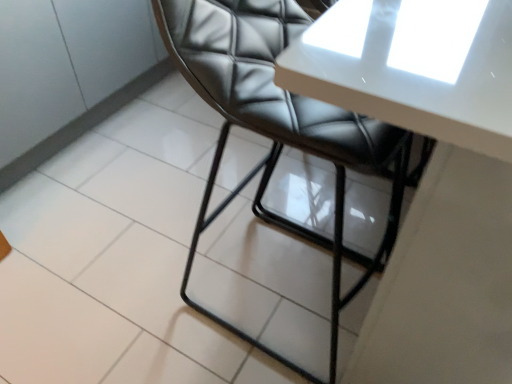
Measure the distance between black leather chair at center and camera.

They are 63.46 centimeters apart.

The image size is (512, 384). I want to click on black leather chair at center, so click(x=281, y=127).

The width and height of the screenshot is (512, 384). What do you see at coordinates (281, 127) in the screenshot?
I see `black leather chair at center` at bounding box center [281, 127].

The image size is (512, 384). Describe the element at coordinates (429, 182) in the screenshot. I see `white glossy table at upper center` at that location.

Looking at this image, what is the approximate height of white glossy table at upper center?

white glossy table at upper center is 91.91 centimeters in height.

Where is `white glossy table at upper center`? This screenshot has width=512, height=384. white glossy table at upper center is located at coordinates (429, 182).

Identify the location of black leather chair at center. (281, 127).

Considering the positions of objects white glossy table at upper center and black leather chair at center in the image provided, who is more to the left, white glossy table at upper center or black leather chair at center?

From the viewer's perspective, black leather chair at center appears more on the left side.

Considering their positions, is white glossy table at upper center located in front of or behind black leather chair at center?

In the image, white glossy table at upper center appears in front of black leather chair at center.

Is point (479, 297) closer to camera compared to point (190, 76)?

Yes, it is in front of point (190, 76).

From the image's perspective, relative to black leather chair at center, is white glossy table at upper center above or below?

Based on their image positions, white glossy table at upper center is located above black leather chair at center.

From a real-world perspective, is white glossy table at upper center below black leather chair at center?

Yes.

Is white glossy table at upper center thinner than black leather chair at center?

Incorrect, the width of white glossy table at upper center is not less than that of black leather chair at center.

Can you confirm if white glossy table at upper center is taller than black leather chair at center?

In fact, white glossy table at upper center may be shorter than black leather chair at center.

Can you confirm if white glossy table at upper center is bigger than black leather chair at center?

Yes.

Would you say black leather chair at center is part of white glossy table at upper center's contents?

Yes, black leather chair at center can be found within white glossy table at upper center.

Are white glossy table at upper center and black leather chair at center far apart?

No, white glossy table at upper center is in close proximity to black leather chair at center.

Could you tell me if white glossy table at upper center is facing black leather chair at center?

No, white glossy table at upper center is not facing towards black leather chair at center.

How many degrees apart are the facing directions of white glossy table at upper center and black leather chair at center?

white glossy table at upper center and black leather chair at center are facing 0.338 degrees away from each other.

Image resolution: width=512 pixels, height=384 pixels. I want to click on table above the black leather chair at center (from the image's perspective), so click(429, 182).

Considering the positions of objects black leather chair at center and white glossy table at upper center in the image provided, who is more to the left, black leather chair at center or white glossy table at upper center?

Positioned to the left is black leather chair at center.

Who is more distant, black leather chair at center or white glossy table at upper center?

black leather chair at center is behind.

Considering the points (391, 202) and (410, 225), which point is in front, point (391, 202) or point (410, 225)?

Positioned in front is point (410, 225).

From the image's perspective, is black leather chair at center above white glossy table at upper center?

Incorrect, from the image's perspective, black leather chair at center is lower than white glossy table at upper center.

In the scene shown: From a real-world perspective, is black leather chair at center positioned above or below white glossy table at upper center?

Clearly, from a real-world perspective, black leather chair at center is above white glossy table at upper center.

Is black leather chair at center wider than white glossy table at upper center?

No, black leather chair at center is not wider than white glossy table at upper center.

Which of these two, black leather chair at center or white glossy table at upper center, stands shorter?

Standing shorter between the two is white glossy table at upper center.

Between black leather chair at center and white glossy table at upper center, which one has larger size?

Bigger between the two is white glossy table at upper center.

Would you say black leather chair at center is outside white glossy table at upper center?

No, black leather chair at center is not entirely external to white glossy table at upper center.

Is black leather chair at center beside white glossy table at upper center?

black leather chair at center and white glossy table at upper center are not in contact.

From the picture: Is black leather chair at center positioned with its back to white glossy table at upper center?

black leather chair at center is not turned away from white glossy table at upper center.

Measure the distance from black leather chair at center to white glossy table at upper center.

black leather chair at center and white glossy table at upper center are 10.65 inches apart from each other.

Locate an element on the screen. chair behind the white glossy table at upper center is located at coordinates (281, 127).

Locate an element on the screen. The height and width of the screenshot is (384, 512). chair on the left of white glossy table at upper center is located at coordinates (281, 127).

Identify the location of table in front of the black leather chair at center. (429, 182).